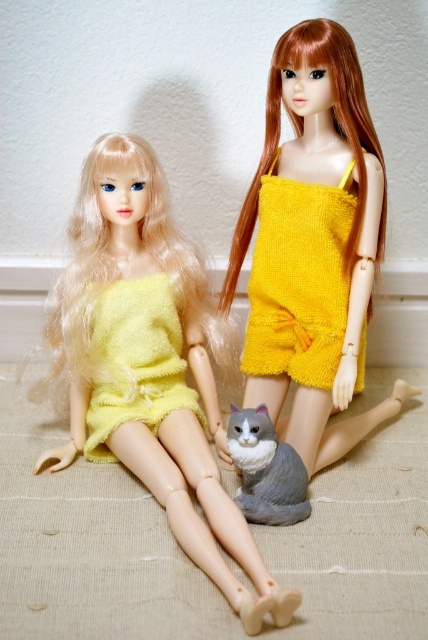
Measure the distance from yellow fuzzy dress at center to gray plush cat at lower center.

They are 9.36 inches apart.

What do you see at coordinates (299, 280) in the screenshot? I see `yellow fuzzy dress at center` at bounding box center [299, 280].

Image resolution: width=428 pixels, height=640 pixels. Find the location of `yellow fuzzy dress at center`. yellow fuzzy dress at center is located at coordinates (299, 280).

Is point (235, 269) positioned before point (309, 250)?

No.

This screenshot has height=640, width=428. What do you see at coordinates (314, 244) in the screenshot?
I see `yellow knitted romper at center` at bounding box center [314, 244].

Image resolution: width=428 pixels, height=640 pixels. What do you see at coordinates (314, 244) in the screenshot?
I see `yellow knitted romper at center` at bounding box center [314, 244].

In order to click on yellow knitted romper at center in this screenshot , I will do `click(314, 244)`.

Does matte yellow fabric dress at left have a larger size compared to yellow knitted romper at center?

Indeed, matte yellow fabric dress at left has a larger size compared to yellow knitted romper at center.

Does point (219, 323) come behind point (300, 164)?

That is True.

At what (x,y) coordinates should I click in order to perform the action: click on matte yellow fabric dress at left. Please return your answer as a coordinate pair (x, y). This screenshot has height=640, width=428. Looking at the image, I should click on [148, 364].